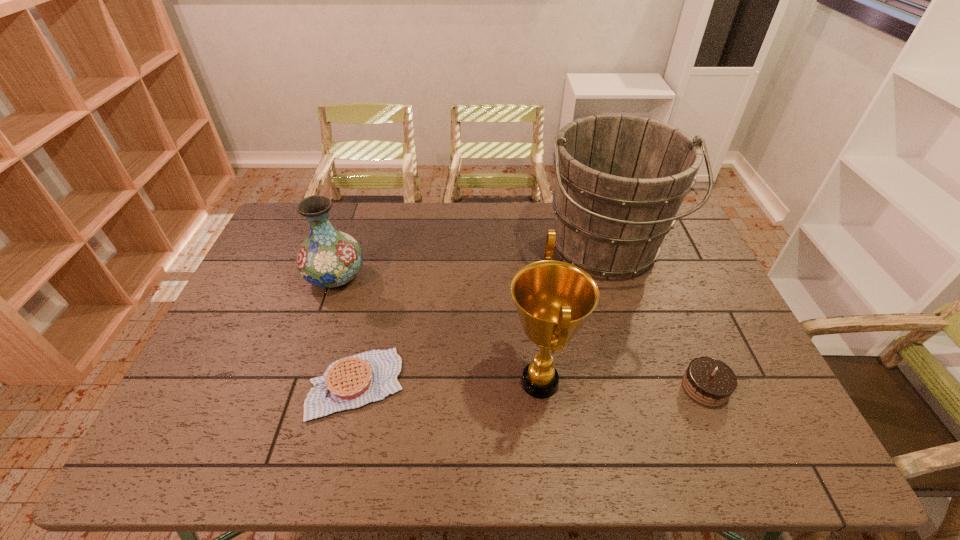
Locate an element on the screen. The width and height of the screenshot is (960, 540). bucket is located at coordinates (620, 180).

Identify the location of award. (553, 299).

This screenshot has width=960, height=540. I want to click on the third tallest object, so click(328, 258).

Locate an element on the screen. the second shortest object is located at coordinates (708, 381).

In order to click on pie in this screenshot , I will do `click(351, 382)`.

In order to click on blank area located on the handle side of the bucket in this screenshot , I will do `click(642, 370)`.

Find the location of a particular element. Image resolution: width=960 pixels, height=540 pixels. vacant space located 0.350m on the front view with handles of the award is located at coordinates (372, 382).

The width and height of the screenshot is (960, 540). What are the coordinates of `vacant region located 0.290m on the front view with handles of the award` in the screenshot? It's located at (395, 382).

This screenshot has width=960, height=540. Find the location of `vacant space located 0.240m on the front view with handles of the award`. vacant space located 0.240m on the front view with handles of the award is located at coordinates (413, 382).

The image size is (960, 540). In order to click on vacant region located 0.150m on the right of the third tallest object in this screenshot , I will do `click(412, 277)`.